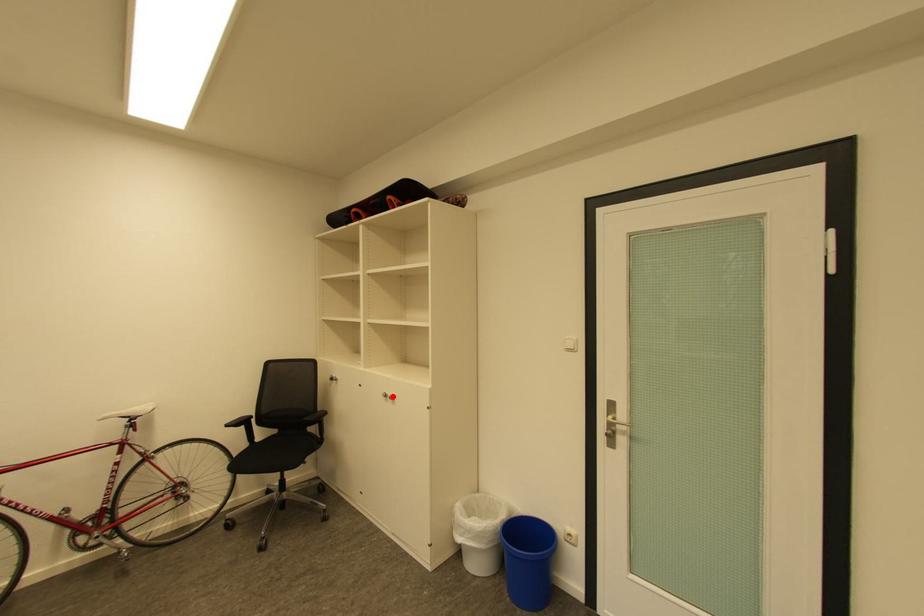
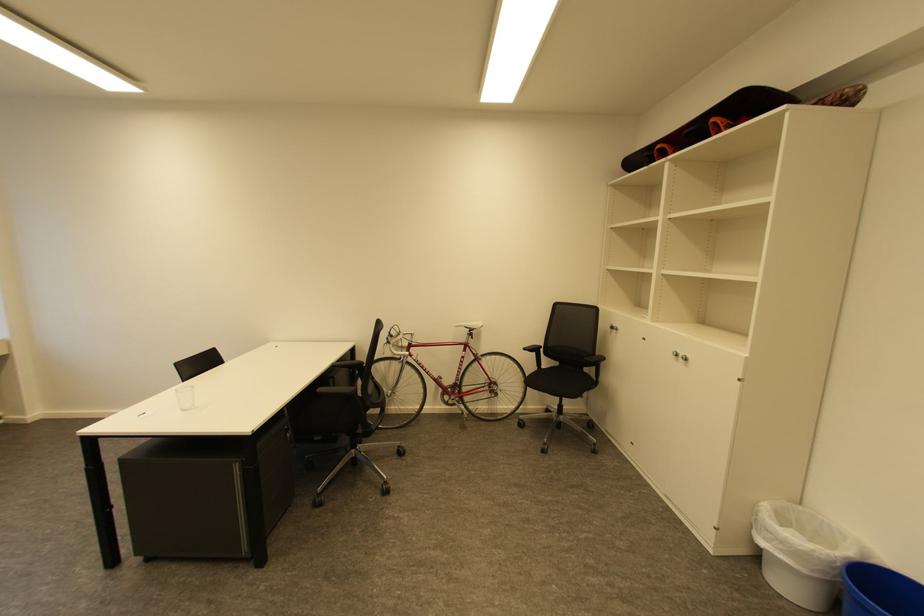
Question: I am providing you with two images of the same scene from different viewpoints. A red point is marked on the first image. At the location where the point appears in image 1, is it still visible in image 2?

Choices:
 (A) Yes
 (B) No

Answer: (A)